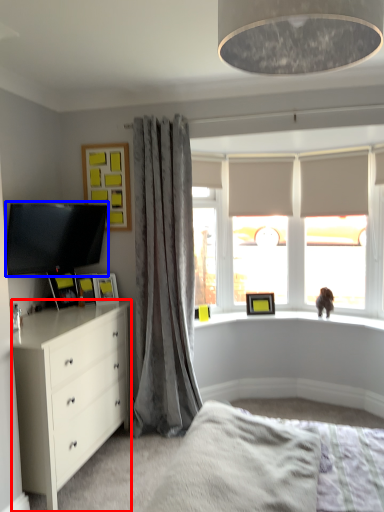
Question: Which point is further to the camera, chest of drawers (highlighted by a red box) or television (highlighted by a blue box)?

Choices:
 (A) chest of drawers
 (B) television

Answer: (B)